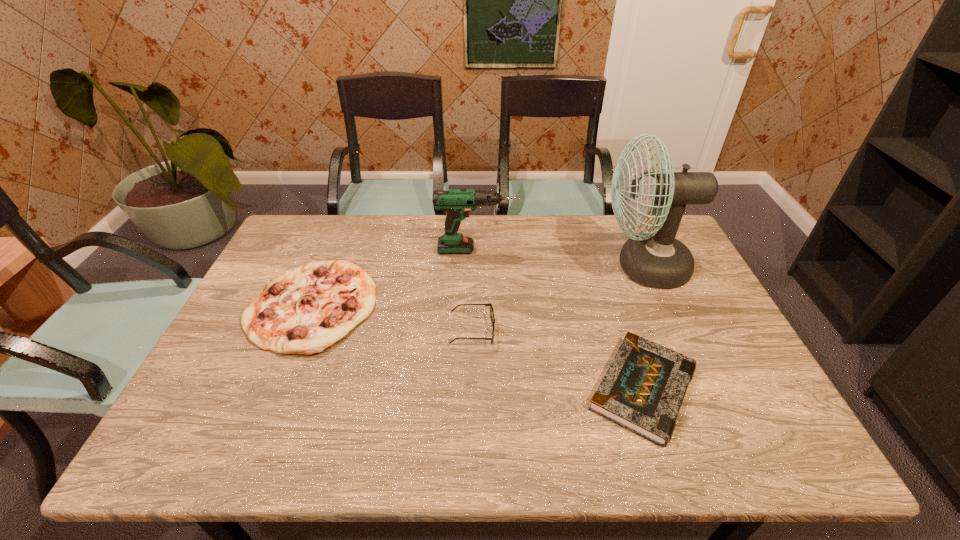
Locate an element on the screen. The image size is (960, 540). free space located on the front-facing side of the spectacles is located at coordinates (544, 330).

I want to click on vacant space situated on the left of the shortest object, so click(540, 389).

Locate an element on the screen. fan that is at the far edge is located at coordinates (656, 259).

Where is `drill positioned at the far edge`? This screenshot has height=540, width=960. drill positioned at the far edge is located at coordinates (457, 203).

The image size is (960, 540). Identify the location of object that is at the near edge. [643, 388].

This screenshot has width=960, height=540. Identify the location of object positioned at the left edge. (302, 311).

Identify the location of fan positioned at the right edge. Image resolution: width=960 pixels, height=540 pixels. (656, 259).

You are a GUI agent. You are given a task and a screenshot of the screen. Output one action in this format:
    pyautogui.click(x=<x>, y=<y>)
    Task: Click on the notebook at the right edge
    The image size is (960, 540).
    Given the screenshot: What is the action you would take?
    pyautogui.click(x=643, y=388)

At what (x,y) coordinates should I click in order to perform the action: click on object that is at the far right corner. Please return your answer as a coordinate pair (x, y). Image resolution: width=960 pixels, height=540 pixels. Looking at the image, I should click on pos(656,259).

Where is `object that is positioned at the near right corner`? The image size is (960, 540). object that is positioned at the near right corner is located at coordinates (643, 388).